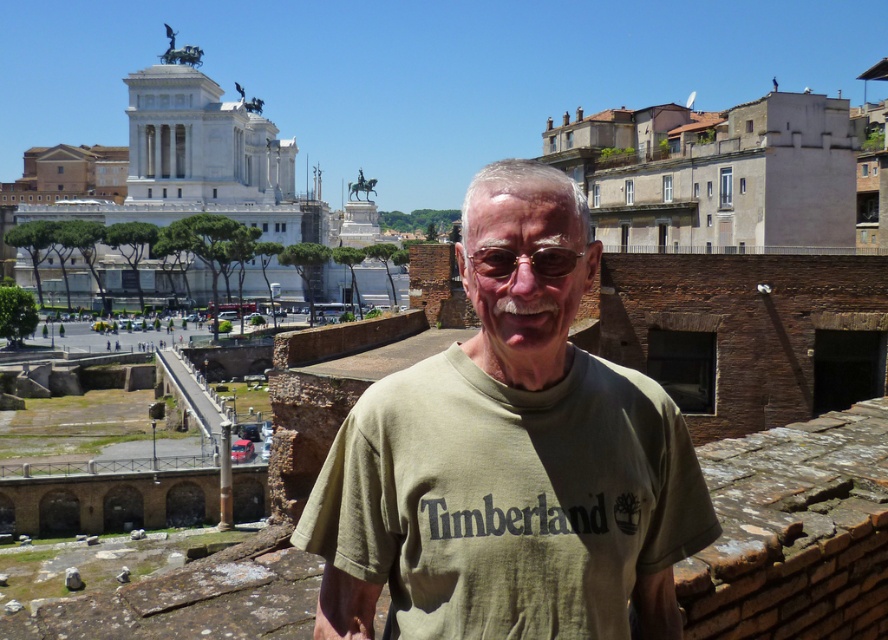
Question: Is green cotton shirt at center further to the viewer compared to gold metallic glasses at center?

Choices:
 (A) no
 (B) yes

Answer: (A)

Question: Does green cotton shirt at center appear under gold metallic glasses at center?

Choices:
 (A) yes
 (B) no

Answer: (A)

Question: Which point is farther from the camera taking this photo?

Choices:
 (A) (637, 541)
 (B) (485, 273)

Answer: (B)

Question: Which object appears closest to the camera in this image?

Choices:
 (A) green cotton shirt at center
 (B) gold metallic glasses at center

Answer: (A)

Question: Which point is closer to the camera?

Choices:
 (A) gold metallic glasses at center
 (B) green cotton shirt at center

Answer: (B)

Question: Does green cotton shirt at center have a larger size compared to gold metallic glasses at center?

Choices:
 (A) no
 (B) yes

Answer: (B)